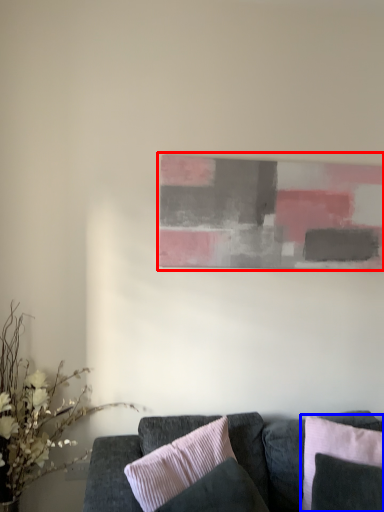
Question: Which of the following is the farthest to the observer, picture frame (highlighted by a red box) or pillow (highlighted by a blue box)?

Choices:
 (A) picture frame
 (B) pillow

Answer: (A)